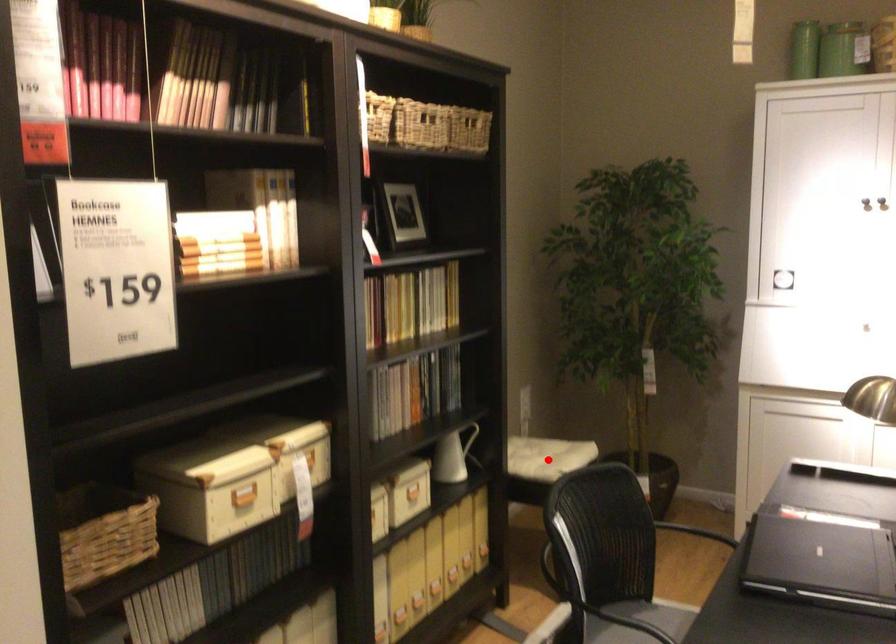
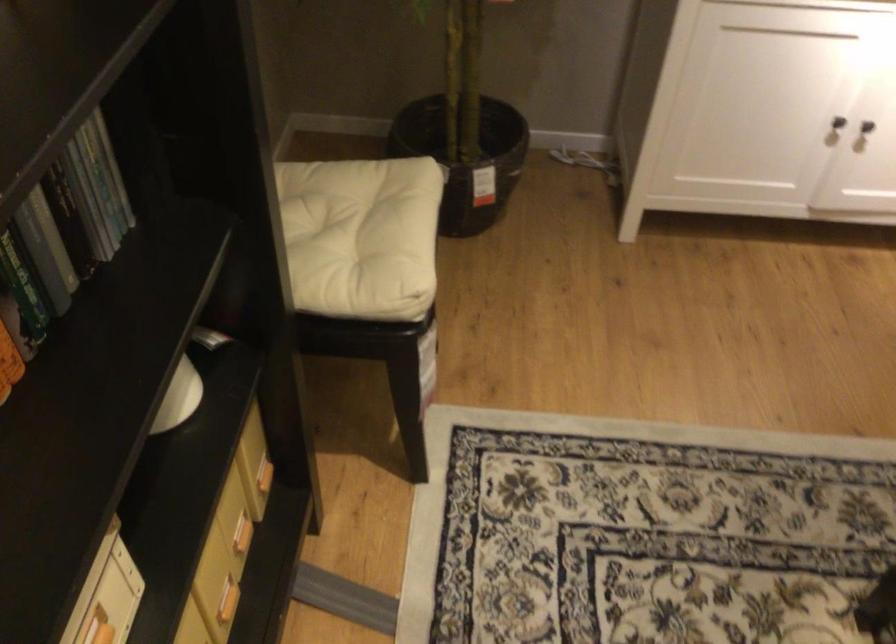
Where in the second image is the point corresponding to the highlighted location from the first image?

(355, 234)